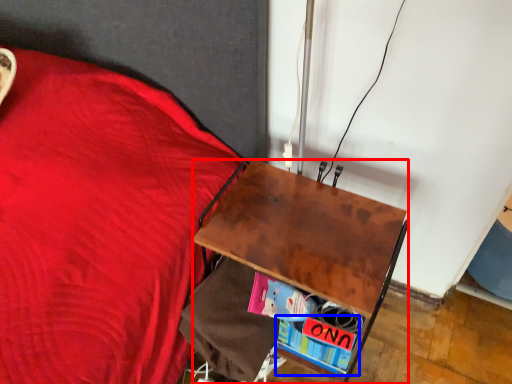
Question: Which point is closer to the camera, desk (highlighted by a red box) or paperback book (highlighted by a blue box)?

Choices:
 (A) desk
 (B) paperback book

Answer: (A)